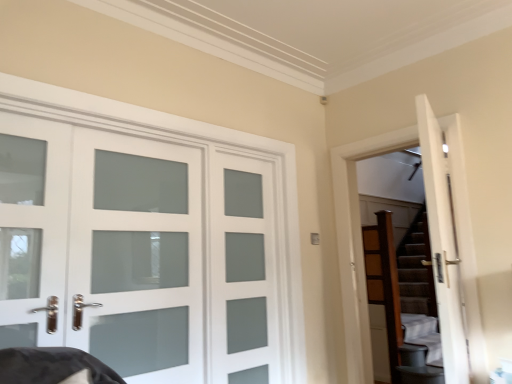
Question: Considering their positions, is white frosted glass door at left, the second screen door when ordered from right to left, located in front of or behind satin glass door at center, which is counted as the 1th screen door, starting from the right?

Choices:
 (A) front
 (B) behind

Answer: (A)

Question: From the image's perspective, is white frosted glass door at left, marked as the 1th screen door in a left-to-right arrangement, above or below satin glass door at center, which is counted as the second screen door, starting from the left?

Choices:
 (A) above
 (B) below

Answer: (A)

Question: Estimate the real-world distances between objects in this image. Which object is closer to the brown textured stairs at right?

Choices:
 (A) white frosted glass door at left
 (B) white frosted glass door at left, the second screen door when ordered from right to left
 (C) satin glass door at center, which is counted as the 1th screen door, starting from the right
 (D) wooden dresser at right

Answer: (C)

Question: Considering the real-world distances, which object is farthest from the satin glass door at center, which is counted as the second screen door, starting from the left?

Choices:
 (A) white frosted glass door at left
 (B) brown textured stairs at right
 (C) wooden dresser at right
 (D) white frosted glass door at left, marked as the 1th screen door in a left-to-right arrangement

Answer: (C)